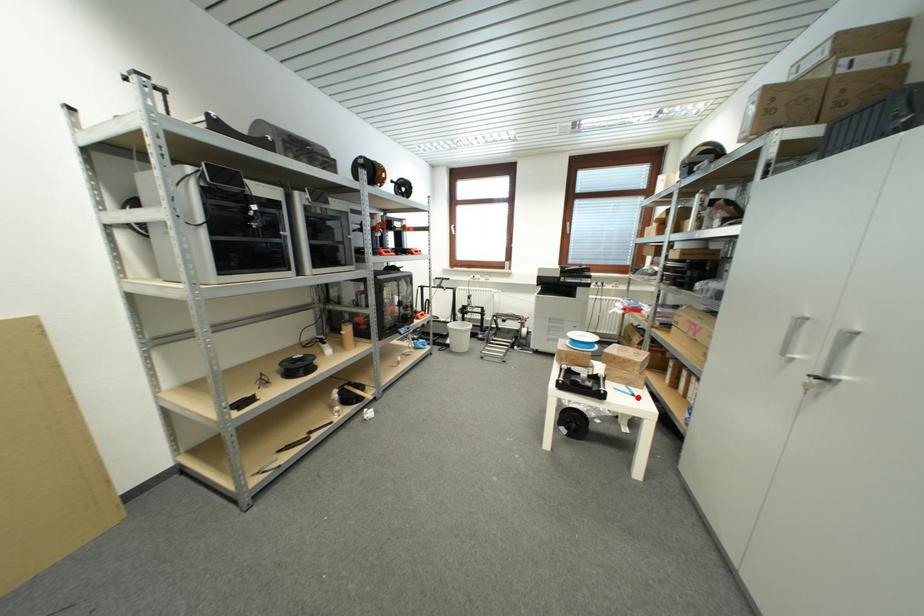
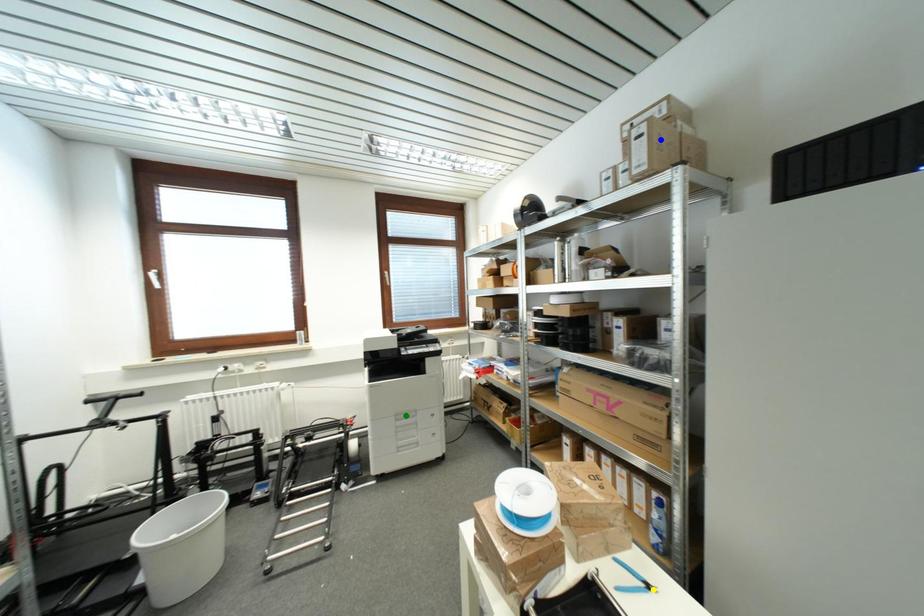
Question: I am providing you with two images of the same scene from different viewpoints. A red point is marked on the first image. You are given multiple points on the second image. Which point in image 2 represents the same 3d spot as the red point in image 1?

Choices:
 (A) blue point
 (B) yellow point
 (C) green point

Answer: (B)